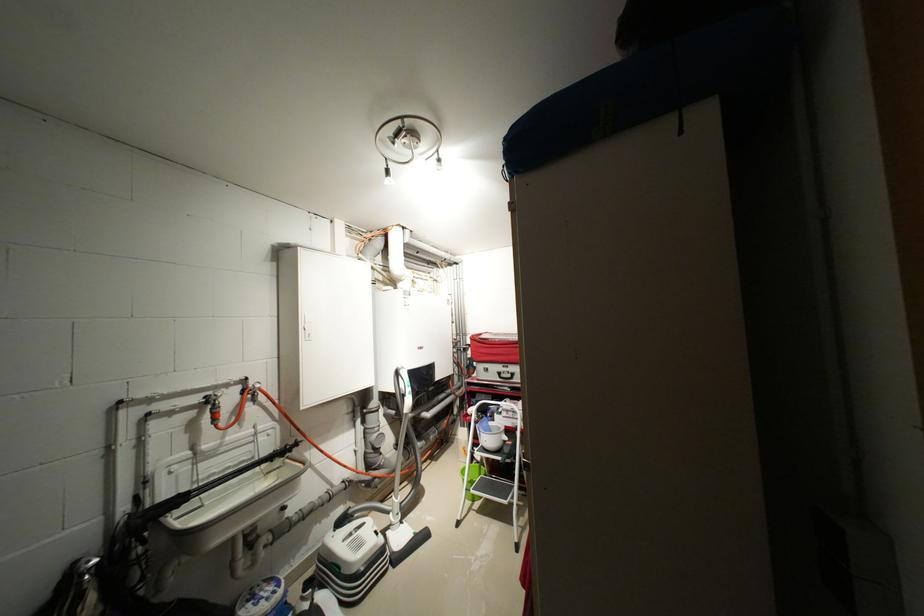
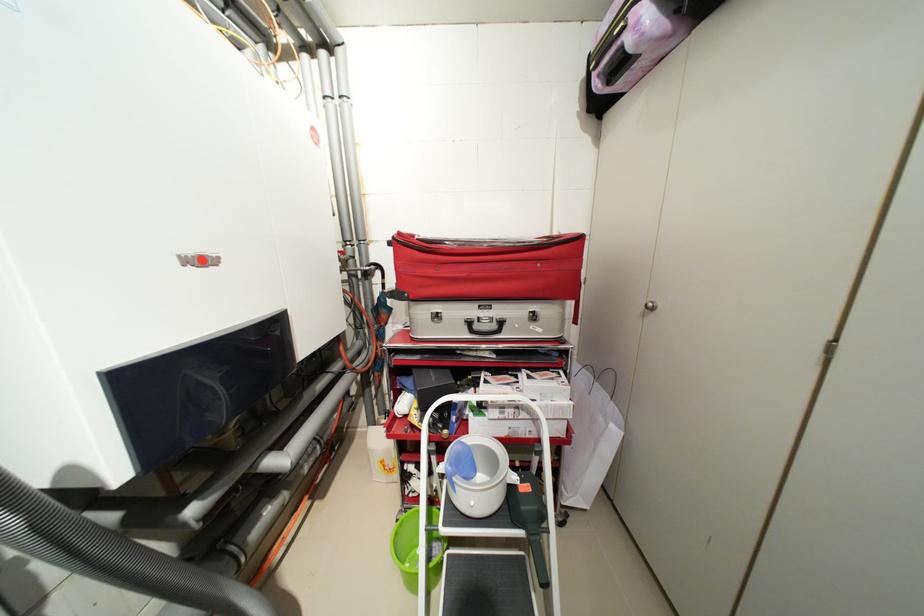
Find the pixel in the second image that matches (480,336) in the first image.

(407, 235)